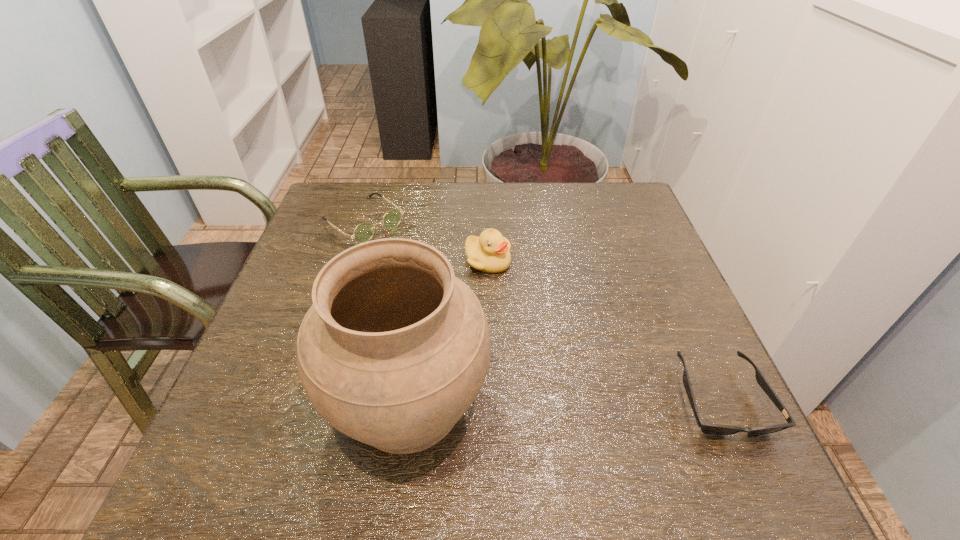
Identify which object is the third closest to the second shortest object. Please provide its 2D coordinates. Your answer should be formatted as a tuple, i.e. [(x, y)], where the tuple contains the x and y coordinates of a point satisfying the conditions above.

[(714, 429)]

Choose which object is the second nearest neighbor to the rightmost object. Please provide its 2D coordinates. Your answer should be formatted as a tuple, i.e. [(x, y)], where the tuple contains the x and y coordinates of a point satisfying the conditions above.

[(490, 252)]

This screenshot has height=540, width=960. I want to click on blank space that satisfies the following two spatial constraints: 1. on the front side of the urn; 2. on the right side of the second shortest object, so click(x=302, y=403).